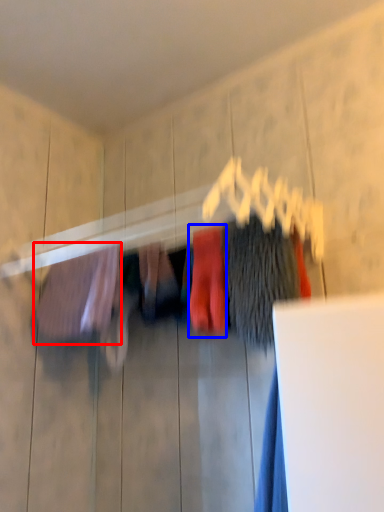
Question: Which object appears closest to the camera in this image, clothing (highlighted by a red box) or clothing (highlighted by a blue box)?

Choices:
 (A) clothing
 (B) clothing

Answer: (B)